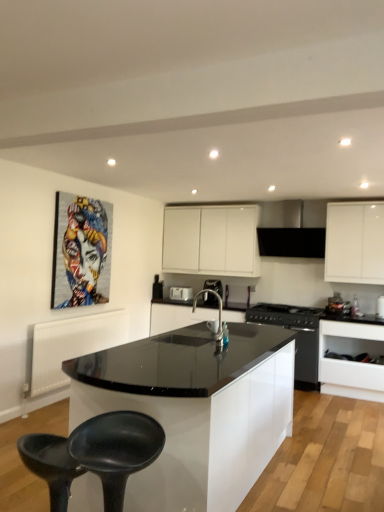
Measure the distance between point (x=347, y=335) and camera.

They are 4.95 meters apart.

Locate an element on the screen. This screenshot has height=512, width=384. black matte range hood at upper center, which is the first kitchen appliance in top-to-bottom order is located at coordinates (292, 228).

In order to face black matte swivel chair at lower left, should I rotate leftwards or rightwards?

Rotate your view left by about 10.534°.

You are a GUI agent. You are given a task and a screenshot of the screen. Output one action in this format:
    pyautogui.click(x=<x>, y=<y>)
    Task: Click on the black glossy microwave at center, placed as the 2th appliance when sorted from left to right
    
    Given the screenshot: What is the action you would take?
    pyautogui.click(x=380, y=307)

Identify the location of satin silver coffee machine at center. Image resolution: width=384 pixels, height=512 pixels. (214, 286).

Where is `black glossy countertop at center, the 2th cabinetry when ordered from top to bottom`? black glossy countertop at center, the 2th cabinetry when ordered from top to bottom is located at coordinates (177, 316).

Find the location of a particular element. The image size is (384, 512). white glossy drawer at lower right, the first cabinetry ordered from the bottom is located at coordinates [351, 361].

Based on the photo, does satin nickel faucet at center turn towards black glossy stove at center, the 2th kitchen appliance positioned from the top?

No, satin nickel faucet at center is not facing towards black glossy stove at center, the 2th kitchen appliance positioned from the top.

Is satin nickel faucet at center spatially inside black glossy stove at center, which is counted as the 1th kitchen appliance, starting from the bottom, or outside of it?

satin nickel faucet at center cannot be found inside black glossy stove at center, which is counted as the 1th kitchen appliance, starting from the bottom.

Does satin nickel faucet at center have a lesser height compared to black glossy stove at center, which is counted as the 1th kitchen appliance, starting from the bottom?

Correct, satin nickel faucet at center is not as tall as black glossy stove at center, which is counted as the 1th kitchen appliance, starting from the bottom.

Between white glossy cabinet at upper center, which appears as the first cabinetry when viewed from the top, and metallic textured portrait at upper left, which one has larger width?

With larger width is white glossy cabinet at upper center, which appears as the first cabinetry when viewed from the top.

Is white glossy cabinet at upper center, which appears as the first cabinetry when viewed from the top, surrounding metallic textured portrait at upper left?

No, white glossy cabinet at upper center, which appears as the first cabinetry when viewed from the top, does not contain metallic textured portrait at upper left.

Between white glossy cabinet at upper center, positioned as the third cabinetry in bottom-to-top order, and metallic textured portrait at upper left, which one has more height?

With more height is metallic textured portrait at upper left.

Which cabinetry is the 3rd one when counting from the back of the metallic textured portrait at upper left? Please provide its 2D coordinates.

[(211, 240)]

Is black glossy stove at center, which is counted as the 1th kitchen appliance, starting from the bottom, positioned with its back to white glossy toaster at center, the 1th appliance positioned from the back?

No, white glossy toaster at center, the 1th appliance positioned from the back, is not at the back of black glossy stove at center, which is counted as the 1th kitchen appliance, starting from the bottom.

Considering the sizes of objects black glossy stove at center, the 2th kitchen appliance positioned from the top, and white glossy toaster at center, which is the second appliance in front-to-back order, in the image provided, who is smaller, black glossy stove at center, the 2th kitchen appliance positioned from the top, or white glossy toaster at center, which is the second appliance in front-to-back order,?

white glossy toaster at center, which is the second appliance in front-to-back order.

In the scene shown: Does black glossy stove at center, which is counted as the 1th kitchen appliance, starting from the bottom, have a lesser width compared to white glossy toaster at center, the 1th appliance positioned from the back?

Incorrect, the width of black glossy stove at center, which is counted as the 1th kitchen appliance, starting from the bottom, is not less than that of white glossy toaster at center, the 1th appliance positioned from the back.

Does white glossy drawer at lower right, the first cabinetry ordered from the bottom, come behind black matte range hood at upper center, which is the first kitchen appliance in top-to-bottom order?

No, white glossy drawer at lower right, the first cabinetry ordered from the bottom, is closer to the camera.

Between white glossy drawer at lower right, the first cabinetry ordered from the bottom, and black matte range hood at upper center, arranged as the 2th kitchen appliance when ordered from the bottom, which one appears on the right side from the viewer's perspective?

white glossy drawer at lower right, the first cabinetry ordered from the bottom, is more to the right.

Can we say white glossy drawer at lower right, the first cabinetry ordered from the bottom, lies outside black matte range hood at upper center, arranged as the 2th kitchen appliance when ordered from the bottom?

→ Yes.

In the scene shown: Measure the distance from white glossy drawer at lower right, the third cabinetry from the top, to black matte range hood at upper center, which is the first kitchen appliance in top-to-bottom order.

The distance of white glossy drawer at lower right, the third cabinetry from the top, from black matte range hood at upper center, which is the first kitchen appliance in top-to-bottom order, is 1.34 meters.

Which of these two, black glossy countertop at center, the 2th cabinetry when ordered from top to bottom, or black glossy microwave at center, placed as the second appliance when sorted from back to front, is wider?

black glossy countertop at center, the 2th cabinetry when ordered from top to bottom, is wider.

In the image, is black glossy countertop at center, the second cabinetry in the bottom-to-top sequence, on the left side or the right side of black glossy microwave at center, the 1th appliance when ordered from right to left?

black glossy countertop at center, the second cabinetry in the bottom-to-top sequence, is positioned on black glossy microwave at center, the 1th appliance when ordered from right to left,'s left side.

Find the location of a particular element. The height and width of the screenshot is (512, 384). cabinetry that is the 3rd one when counting leftward from the black glossy microwave at center, the 1th appliance when ordered from right to left is located at coordinates (177, 316).

This screenshot has height=512, width=384. Find the location of `picture frame above the black glossy microwave at center, placed as the second appliance when sorted from back to front (from a real-world perspective)`. picture frame above the black glossy microwave at center, placed as the second appliance when sorted from back to front (from a real-world perspective) is located at coordinates 81,251.

Is black glossy microwave at center, the 1th appliance when ordered from right to left, completely or partially outside of metallic textured portrait at upper left?

Yes.

Which is less distant, (379, 317) or (82, 237)?

Point (379, 317) is positioned farther from the camera compared to point (82, 237).

From the image's perspective, between black matte swivel chair at lower left and black glass stove at center, which one is located above?

black glass stove at center, from the image's perspective.

Considering the relative positions of black matte swivel chair at lower left and black glass stove at center in the image provided, is black matte swivel chair at lower left to the left of black glass stove at center from the viewer's perspective?

Yes, black matte swivel chair at lower left is to the left of black glass stove at center.

Is black matte swivel chair at lower left located outside black glass stove at center?

black matte swivel chair at lower left lies outside black glass stove at center's area.

Considering the relative sizes of black matte swivel chair at lower left and black glass stove at center in the image provided, is black matte swivel chair at lower left taller than black glass stove at center?

Correct, black matte swivel chair at lower left is much taller as black glass stove at center.

This screenshot has width=384, height=512. What are the coordinates of `tap in front of the black glossy stove at center, the 2th kitchen appliance positioned from the top` in the screenshot? It's located at (219, 314).

Where is `picture frame directly beneath the white glossy cabinet at upper center, which appears as the first cabinetry when viewed from the top (from a real-world perspective)`? The image size is (384, 512). picture frame directly beneath the white glossy cabinet at upper center, which appears as the first cabinetry when viewed from the top (from a real-world perspective) is located at coordinates (81, 251).

Considering their positions, is black glossy countertop at center, the second cabinetry in the bottom-to-top sequence, positioned closer to satin silver coffee machine at center than black matte bar stool at lower left?

The object closer to satin silver coffee machine at center is black glossy countertop at center, the second cabinetry in the bottom-to-top sequence.

Looking at the image, which one is located closer to satin nickel faucet at center, black matte bar stool at lower left or white glossy toaster at center, the 1th appliance positioned from the back?

white glossy toaster at center, the 1th appliance positioned from the back, is closer to satin nickel faucet at center.

Based on their spatial positions, is black matte bar stool at lower left or black glossy microwave at center, the 1th appliance when ordered from right to left, closer to satin silver coffee machine at center?

The object closer to satin silver coffee machine at center is black glossy microwave at center, the 1th appliance when ordered from right to left.

Consider the image. Considering their positions, is black matte range hood at upper center, arranged as the 2th kitchen appliance when ordered from the bottom, positioned closer to satin nickel faucet at center than white glossy drawer at lower right, the first cabinetry ordered from the bottom?

Among the two, black matte range hood at upper center, arranged as the 2th kitchen appliance when ordered from the bottom, is located nearer to satin nickel faucet at center.

Estimate the real-world distances between objects in this image. Which object is closer to white glossy cabinet at upper center, which appears as the first cabinetry when viewed from the top, white glossy toaster at center, which is the second appliance in front-to-back order, or black matte swivel chair at lower left?

white glossy toaster at center, which is the second appliance in front-to-back order, lies closer to white glossy cabinet at upper center, which appears as the first cabinetry when viewed from the top, than the other object.

Which object lies nearer to the anchor point metallic textured portrait at upper left, black matte range hood at upper center, arranged as the 2th kitchen appliance when ordered from the bottom, or black matte bar stool at lower left?

Based on the image, black matte bar stool at lower left appears to be nearer to metallic textured portrait at upper left.

Estimate the real-world distances between objects in this image. Which object is closer to metallic textured portrait at upper left, white glossy toaster at center, arranged as the 1th appliance when viewed from the left, or black matte range hood at upper center, which is the first kitchen appliance in top-to-bottom order?

The object closer to metallic textured portrait at upper left is white glossy toaster at center, arranged as the 1th appliance when viewed from the left.

Looking at this image, which object lies further to the anchor point black glossy stove at center, the 2th kitchen appliance positioned from the top, black matte range hood at upper center, arranged as the 2th kitchen appliance when ordered from the bottom, or black glass stove at center?

black matte range hood at upper center, arranged as the 2th kitchen appliance when ordered from the bottom, is further to black glossy stove at center, the 2th kitchen appliance positioned from the top.

Locate an element on the screen. The width and height of the screenshot is (384, 512). coffee machine located between black glossy countertop at center, the second cabinetry in the bottom-to-top sequence, and black glossy stove at center, the 2th kitchen appliance positioned from the top, in the left-right direction is located at coordinates (214, 286).

Where is `stove between black matte bar stool at lower left and black matte range hood at upper center, arranged as the 2th kitchen appliance when ordered from the bottom, from front to back`? This screenshot has width=384, height=512. stove between black matte bar stool at lower left and black matte range hood at upper center, arranged as the 2th kitchen appliance when ordered from the bottom, from front to back is located at coordinates (285, 315).

Locate an element on the screen. This screenshot has height=512, width=384. coffee machine between metallic textured portrait at upper left and black glossy stove at center, which is counted as the 1th kitchen appliance, starting from the bottom is located at coordinates (214, 286).

Image resolution: width=384 pixels, height=512 pixels. Identify the location of coffee machine situated between white glossy toaster at center, which is the second appliance in front-to-back order, and black glossy stove at center, the 2th kitchen appliance positioned from the top, from left to right. (214, 286).